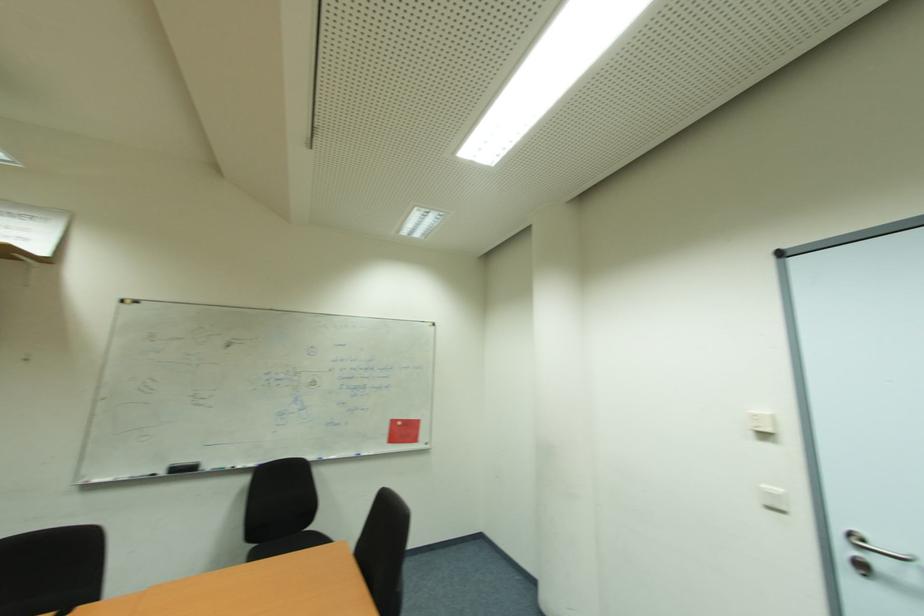
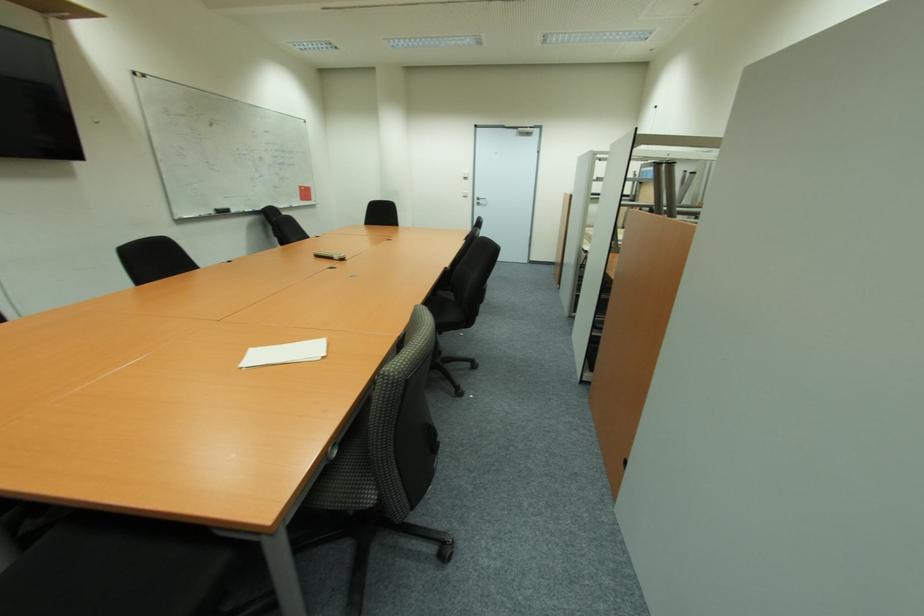
In the second image, find the point that corresponds to the point at 756,435 in the first image.

(467, 179)